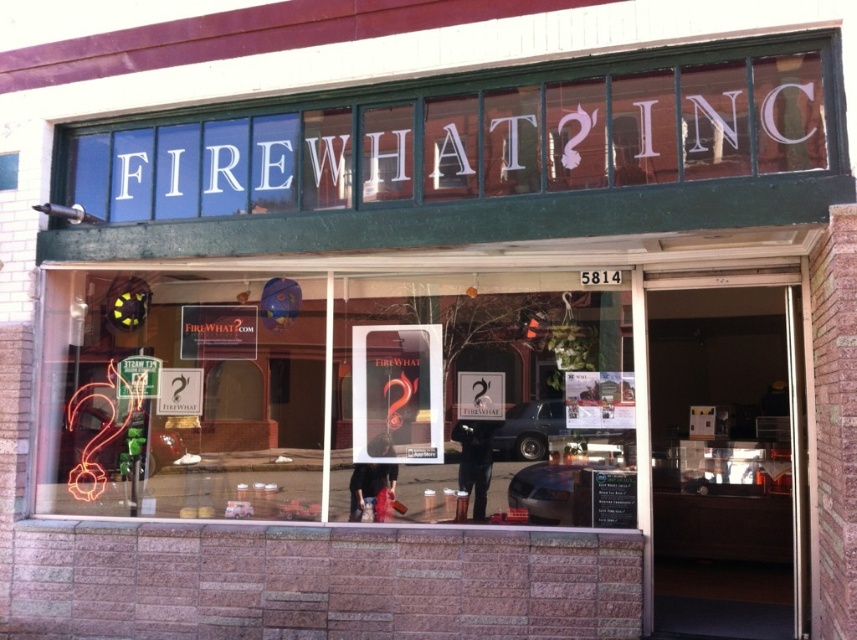
You are standing outside the store and want to look through the translucent glass window at center to see inside. Where should you position yourself relative to the store entrance?

The translucent glass window at center is located at coordinates point [340,396], so you should position yourself directly in front of the store entrance to look through the translucent glass window at center.

You are a delivery person with a box that is 3 feet wide. You need to place the box between the translucent glass window at center and the neon orange sign at upper center. Is there enough space for the box to fit between them?

The distance between the translucent glass window at center and the neon orange sign at upper center is 3.63 feet. Since the box is 3 feet wide, it will fit between them with some space to spare.

You are a delivery person trying to deliver a package to the storefront of FIREWHAT? INC. You need to see through the translucent glass window at center to locate the counter inside. Can the neon orange sign at upper center block your view of the counter?

The translucent glass window at center has a lesser width compared to the neon orange sign at upper center. Since the neon orange sign at upper center is wider, it may block part of the view through the translucent glass window at center, making it harder to see the counter inside.